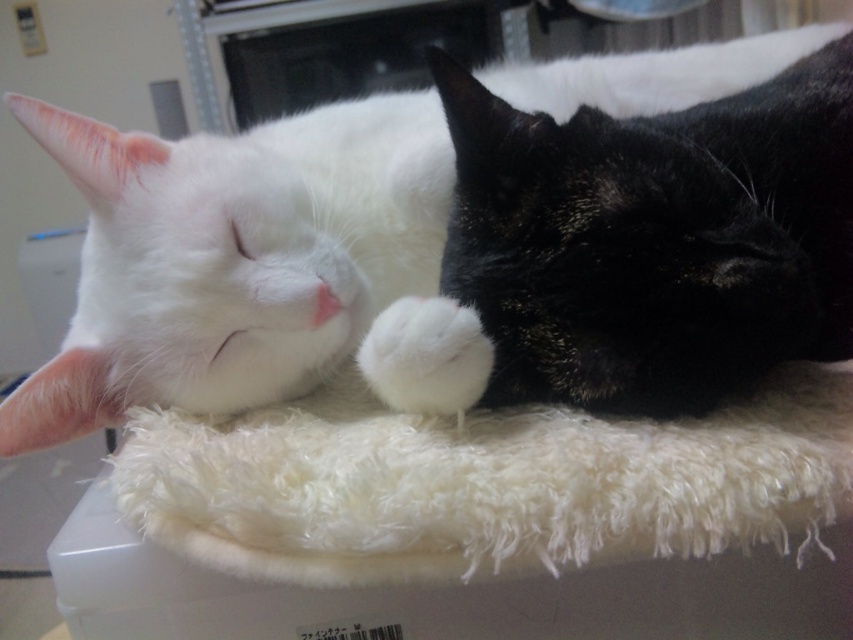
You are a cat owner who wants to place a 10 inch long toy between the white fluffy box at center and the white fluffy paw at center. Can you fit the toy between them without overlapping either object?

The white fluffy box at center and white fluffy paw at center are 8.96 inches apart from each other. Since the toy is 10 inches long, it cannot fit between them without overlapping either object because the distance is shorter than the toy.

You are a photographer trying to capture a closeup shot of the white fluffy cat at center and the white fluffy paw at center. Which object should you zoom in on to ensure you can fit both into the frame without cropping?

You should zoom in on the white fluffy paw at center because the white fluffy cat at center might be wider than the white fluffy paw at center, so focusing on the smaller one allows both to fit in the frame.